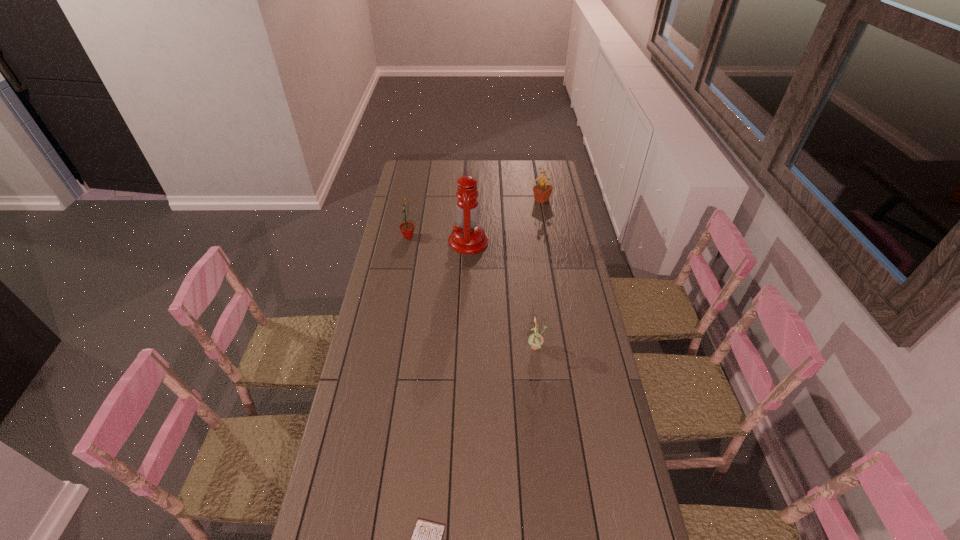
At what (x,y) coordinates should I click in order to perform the action: click on vacant space at the far right corner of the desktop. Please return your answer as a coordinate pair (x, y). This screenshot has width=960, height=540. Looking at the image, I should click on click(539, 172).

This screenshot has width=960, height=540. In order to click on vacant area between the farthest sunflower and the second sunflower from right to left in this screenshot , I will do `click(539, 274)`.

Locate an element on the screen. free space between the nearest sunflower and the second nearest sunflower is located at coordinates (472, 293).

The width and height of the screenshot is (960, 540). Find the location of `vacant point located between the second farthest sunflower and the tallest object`. vacant point located between the second farthest sunflower and the tallest object is located at coordinates (439, 239).

You are a GUI agent. You are given a task and a screenshot of the screen. Output one action in this format:
    pyautogui.click(x=<x>, y=<y>)
    Task: Click on the vacant area that lies between the second farthest sunflower and the oil lamp
    The width and height of the screenshot is (960, 540).
    Given the screenshot: What is the action you would take?
    pyautogui.click(x=439, y=239)

At what (x,y) coordinates should I click in order to perform the action: click on object that is the fourth nearest to the nearest object. Please return your answer as a coordinate pair (x, y). The width and height of the screenshot is (960, 540). Looking at the image, I should click on (542, 191).

Find the location of a particular element. object identified as the second closest to the leftmost sunflower is located at coordinates (542, 191).

Find the location of `sunflower that is the second nearest to the shortest sunflower`. sunflower that is the second nearest to the shortest sunflower is located at coordinates (542, 191).

Identify which sunflower is located as the nearest to the leftmost object. Please provide its 2D coordinates. Your answer should be formatted as a tuple, i.e. [(x, y)], where the tuple contains the x and y coordinates of a point satisfying the conditions above.

[(542, 191)]